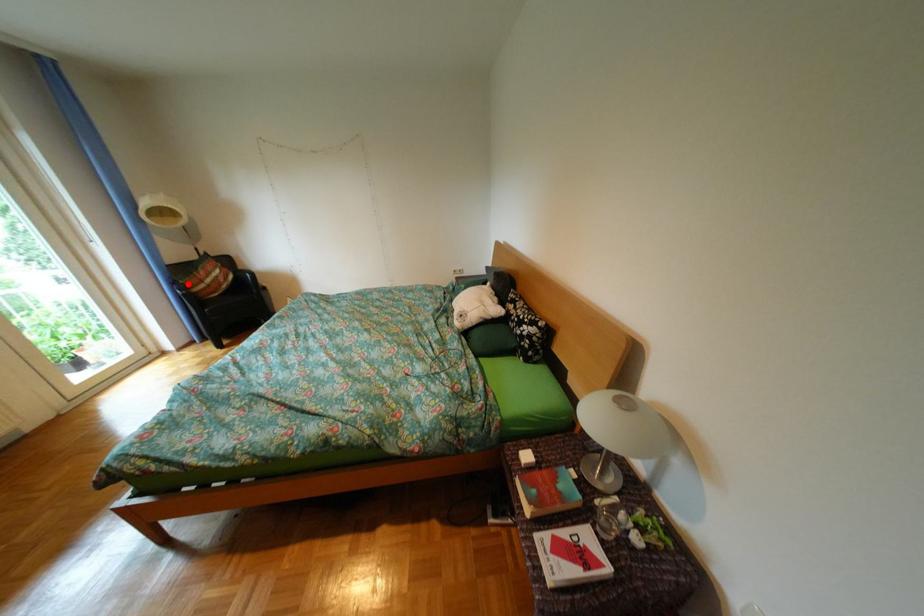
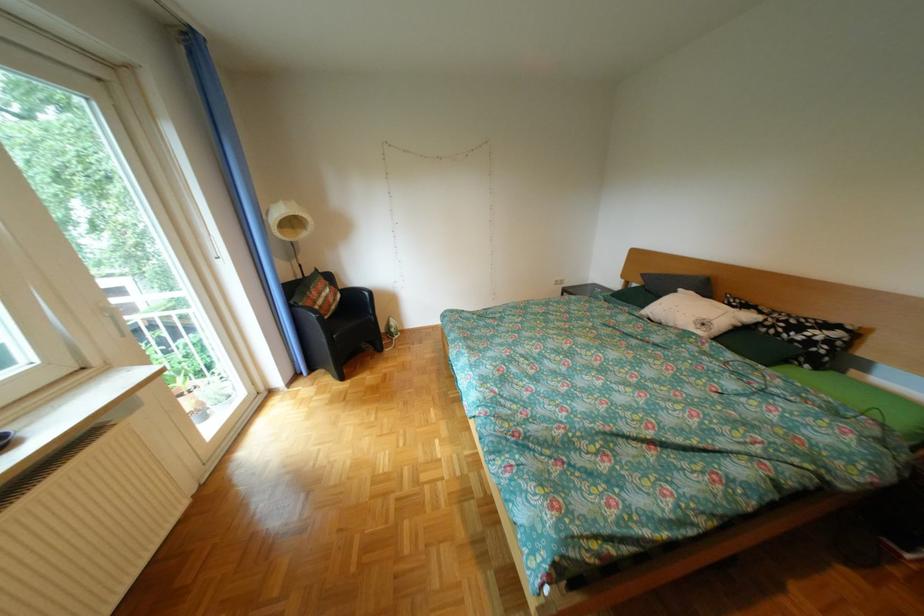
Locate, in the second image, the point that corresponds to the highlighted location in the first image.

(306, 307)